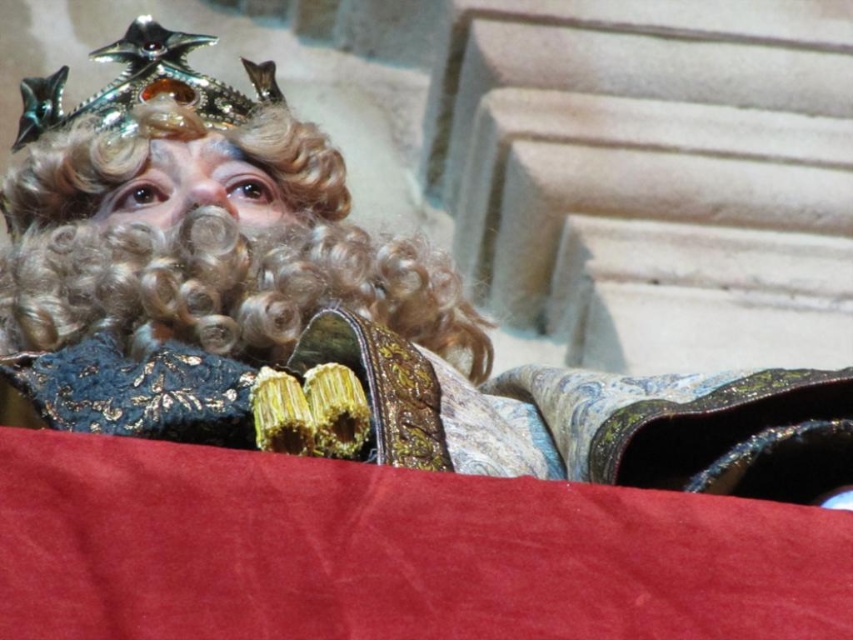
Question: Does velvet/goldenobject at center have a larger size compared to shiny metallic crown at upper left?

Choices:
 (A) yes
 (B) no

Answer: (B)

Question: Which object is closer to the camera taking this photo?

Choices:
 (A) shiny metallic crown at upper left
 (B) velvet/goldenobject at center

Answer: (B)

Question: Is velvet/goldenobject at center positioned at the back of shiny metallic crown at upper left?

Choices:
 (A) no
 (B) yes

Answer: (A)

Question: Does curly blonde wig at upper center have a larger size compared to shiny metallic crown at upper left?

Choices:
 (A) no
 (B) yes

Answer: (A)

Question: Among these objects, which one is farthest from the camera?

Choices:
 (A) shiny metallic crown at upper left
 (B) velvet/goldenobject at center
 (C) curly blonde wig at upper center

Answer: (A)

Question: Among these objects, which one is nearest to the camera?

Choices:
 (A) curly blonde wig at upper center
 (B) velvet/goldenobject at center

Answer: (B)